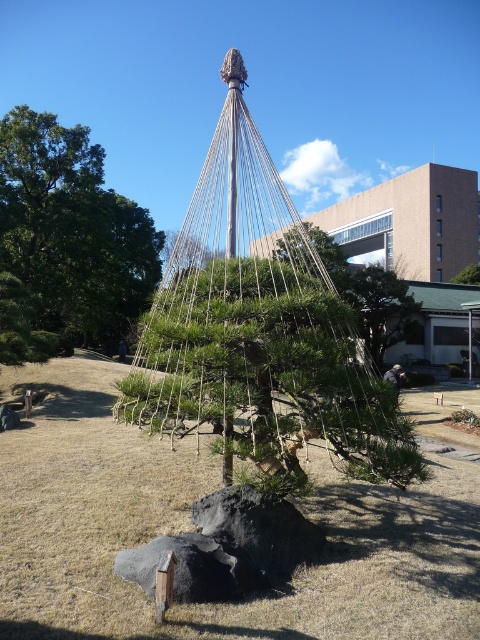
Between point (317, 332) and point (196, 500), which one is positioned behind?

Point (196, 500)

Measure the distance from green matte pine at center to black rough rock at center.

green matte pine at center and black rough rock at center are 74.12 centimeters apart.

Where is `green matte pine at center`? This screenshot has height=640, width=480. green matte pine at center is located at coordinates (266, 374).

Where is `green matte pine at center`? Image resolution: width=480 pixels, height=640 pixels. green matte pine at center is located at coordinates (266, 374).

Can you confirm if black rough rock at center is positioned below green leafy tree at center?

Indeed, black rough rock at center is positioned under green leafy tree at center.

Is black rough rock at center taller than green leafy tree at center?

No.

The height and width of the screenshot is (640, 480). Describe the element at coordinates (259, 528) in the screenshot. I see `black rough rock at center` at that location.

Image resolution: width=480 pixels, height=640 pixels. In order to click on black rough rock at center in this screenshot , I will do `click(259, 528)`.

Can you confirm if green leafy tree at upper left is positioned above black rough rock at center?

Yes.

Does point (10, 138) come in front of point (275, 525)?

That is False.

Image resolution: width=480 pixels, height=640 pixels. Describe the element at coordinates (67, 243) in the screenshot. I see `green leafy tree at upper left` at that location.

The width and height of the screenshot is (480, 640). Identify the location of green leafy tree at upper left. (67, 243).